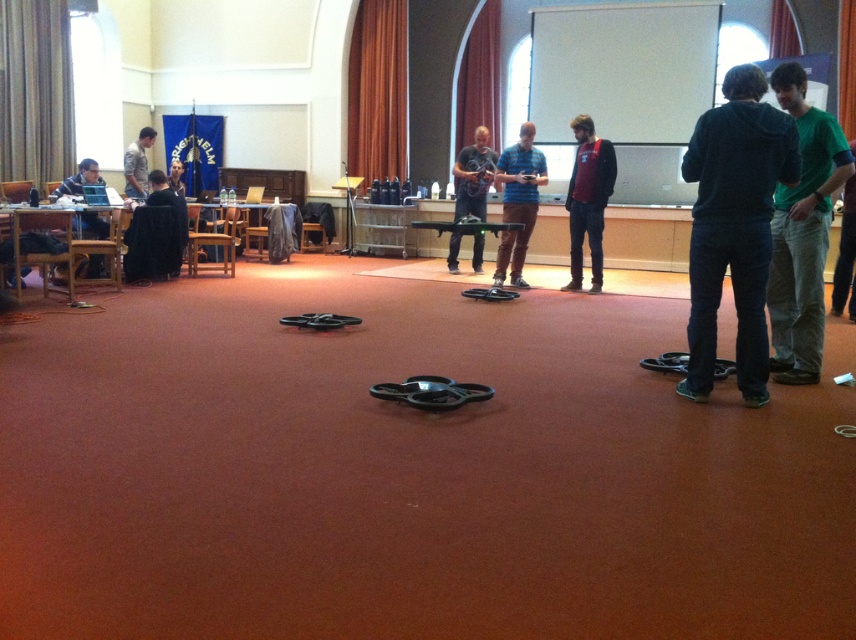
Question: Which object is the closest to the red matte jacket at center?

Choices:
 (A) camouflage shirt at left
 (B) matte black drone at center
 (C) blue striped shirt at center
 (D) matte black laptop at left

Answer: (C)

Question: Does green cotton shirt at right have a smaller size compared to matte black laptop at left?

Choices:
 (A) yes
 (B) no

Answer: (B)

Question: Observing the image, what is the correct spatial positioning of green fabric pants at right in reference to camouflage shirt at left?

Choices:
 (A) below
 (B) above

Answer: (A)

Question: Can you confirm if green cotton shirt at right is bigger than matte black laptop at left?

Choices:
 (A) no
 (B) yes

Answer: (B)

Question: Which of these objects is positioned closest to the red matte jacket at center?

Choices:
 (A) matte black drone at center
 (B) dark blue hoodie at right
 (C) black velvet robe at center

Answer: (A)

Question: Which point appears farthest from the camera in this image?

Choices:
 (A) (827, 164)
 (B) (128, 189)
 (C) (852, 236)

Answer: (B)